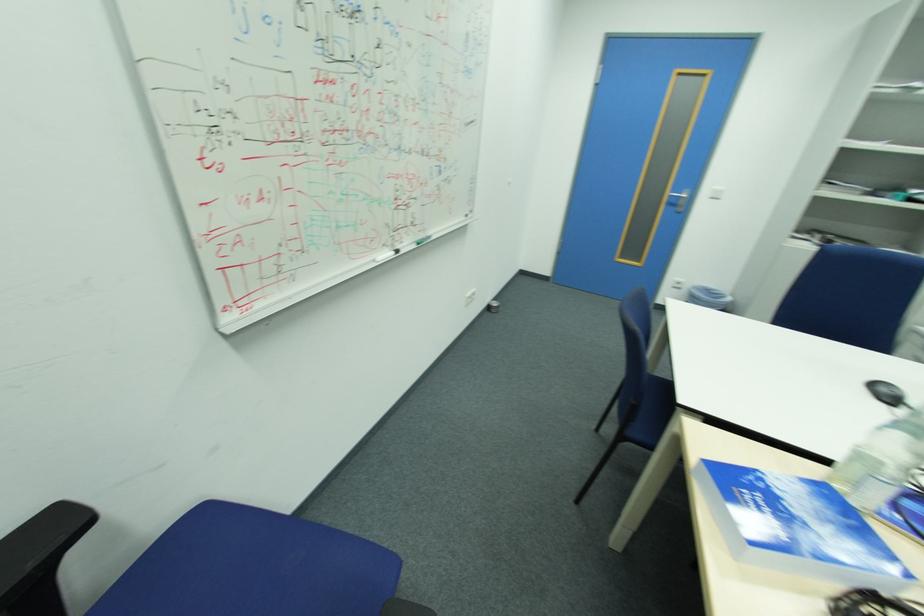
The location [405,249] corresponds to which object?

This point indicates the whiteboard marker.